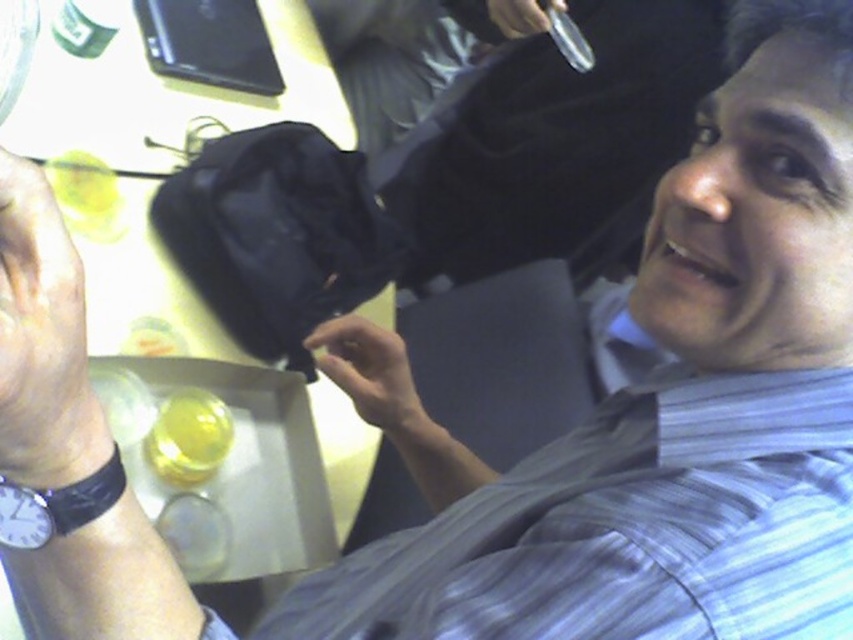
You are organizing a small event and need to place a decorative item on the table. The table has the dry skin at lower left and the matte black bag at center. Which object takes up more space on the table?

The matte black bag at center occupies more space than the dry skin at lower left, so it takes up more space on the table.

You are organizing a small event and need to place a decorative item on the table. The table has a white surface, and you want to place the item at the exact center. However, there is already a black fabric bag at center. Where should you place the item to avoid overlapping with the bag?

The black fabric bag at center is already positioned at the center of the table, so placing the decorative item elsewhere would prevent overlap. Since the bag is at point (276, 236), you could place the item slightly to the left or right, or adjust its vertical position to ensure it doesn not overlap with the existing bag.